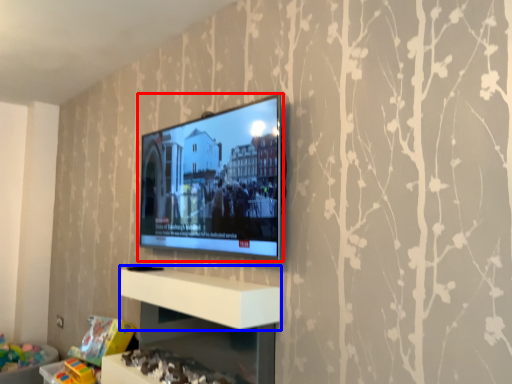
Question: Which object is closer to the camera taking this photo, television (highlighted by a red box) or shelf (highlighted by a blue box)?

Choices:
 (A) television
 (B) shelf

Answer: (B)